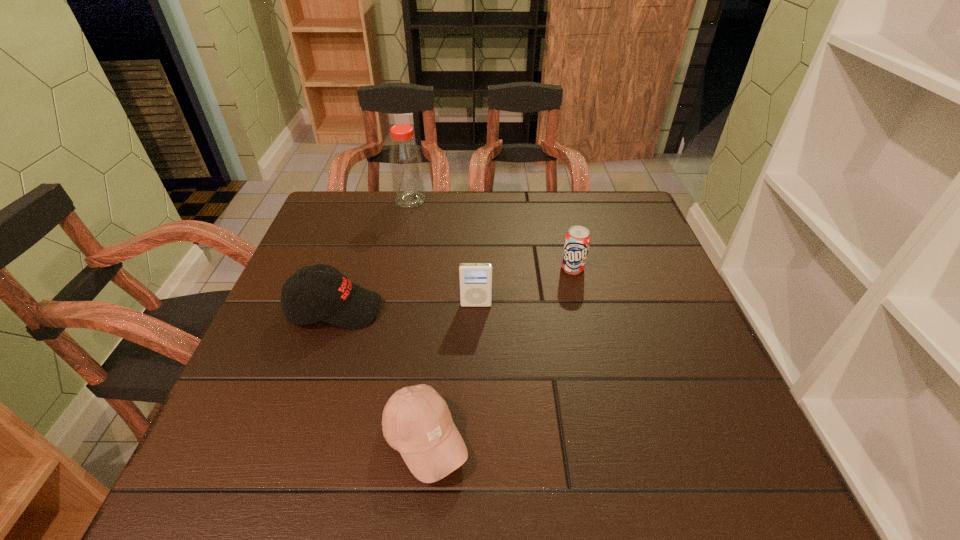
Identify the location of free space that is in between the nearest object and the soda can. This screenshot has width=960, height=540. (499, 354).

Where is `vacant space that's between the soda can and the shortest object`? vacant space that's between the soda can and the shortest object is located at coordinates (499, 354).

At what (x,y) coordinates should I click in order to perform the action: click on free spot between the shortest object and the iPod. Please return your answer as a coordinate pair (x, y). The image size is (960, 540). Looking at the image, I should click on (450, 373).

This screenshot has width=960, height=540. I want to click on object that is the closest to the shortest object, so click(341, 303).

Identify the location of the third closest object relative to the taller baseball cap. (405, 161).

Image resolution: width=960 pixels, height=540 pixels. Find the location of `vacant region that satisfies the following two spatial constraints: 1. on the front-facing side of the iPod; 2. on the front-facing side of the right baseball cap`. vacant region that satisfies the following two spatial constraints: 1. on the front-facing side of the iPod; 2. on the front-facing side of the right baseball cap is located at coordinates [x=475, y=440].

Where is `vacant region that satisfies the following two spatial constraints: 1. on the front-facing side of the iPod; 2. on the front-facing side of the left baseball cap`? Image resolution: width=960 pixels, height=540 pixels. vacant region that satisfies the following two spatial constraints: 1. on the front-facing side of the iPod; 2. on the front-facing side of the left baseball cap is located at coordinates (476, 309).

The width and height of the screenshot is (960, 540). What are the coordinates of `free point that satisfies the following two spatial constraints: 1. on the front side of the soda can; 2. on the left side of the tallest object` in the screenshot? It's located at (396, 268).

Locate an element on the screen. vacant space that satisfies the following two spatial constraints: 1. on the front-facing side of the iPod; 2. on the front-facing side of the farther baseball cap is located at coordinates (476, 309).

The width and height of the screenshot is (960, 540). What are the coordinates of `vacant area that satisfies the following two spatial constraints: 1. on the front side of the rightmost object; 2. on the front-facing side of the shorter baseball cap` in the screenshot? It's located at (613, 440).